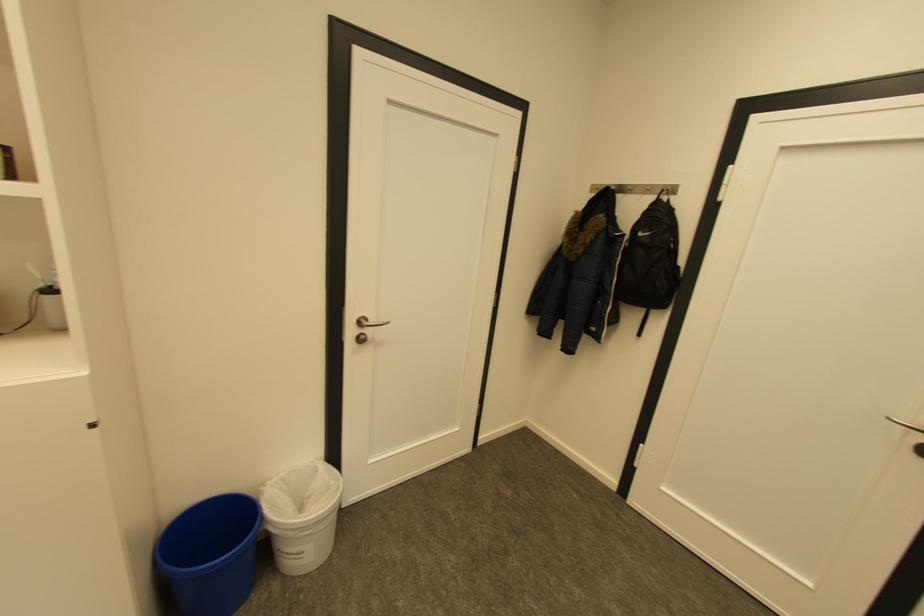
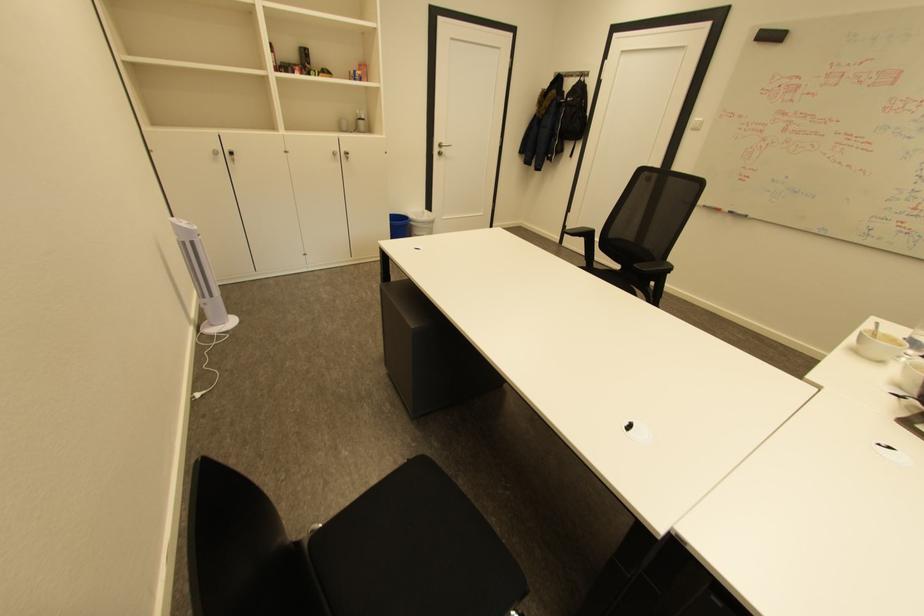
Where in the second image is the point corresponding to point 367,323 from the first image?

(446, 146)